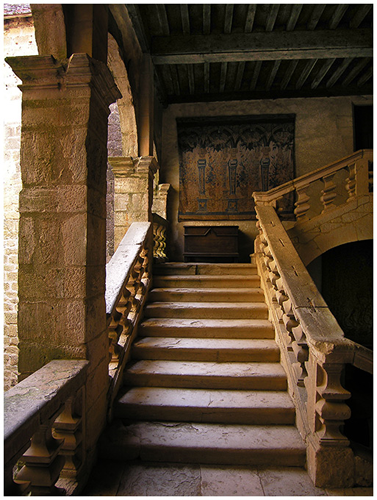
Identify the location of brick wall. (13, 353), (13, 266), (14, 174), (113, 138), (111, 214).